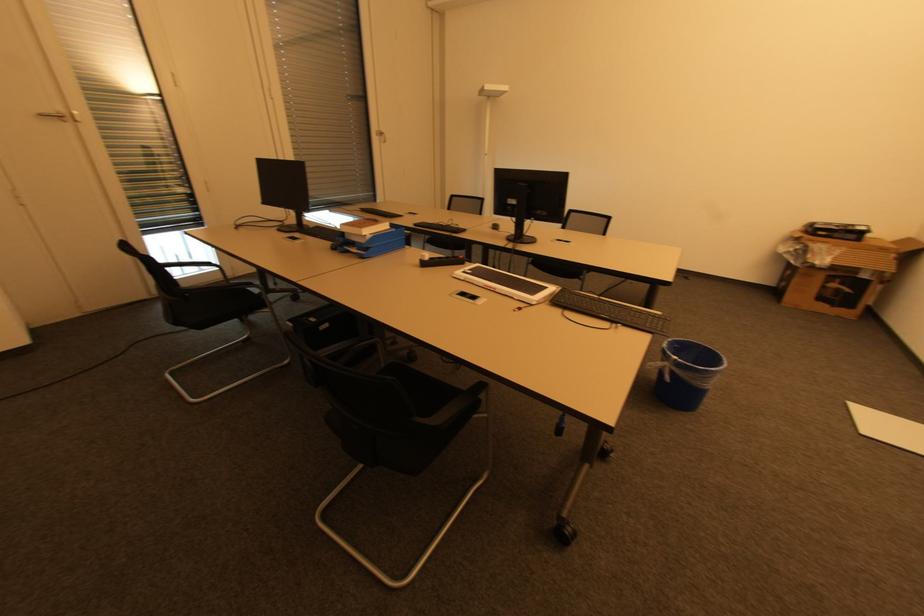
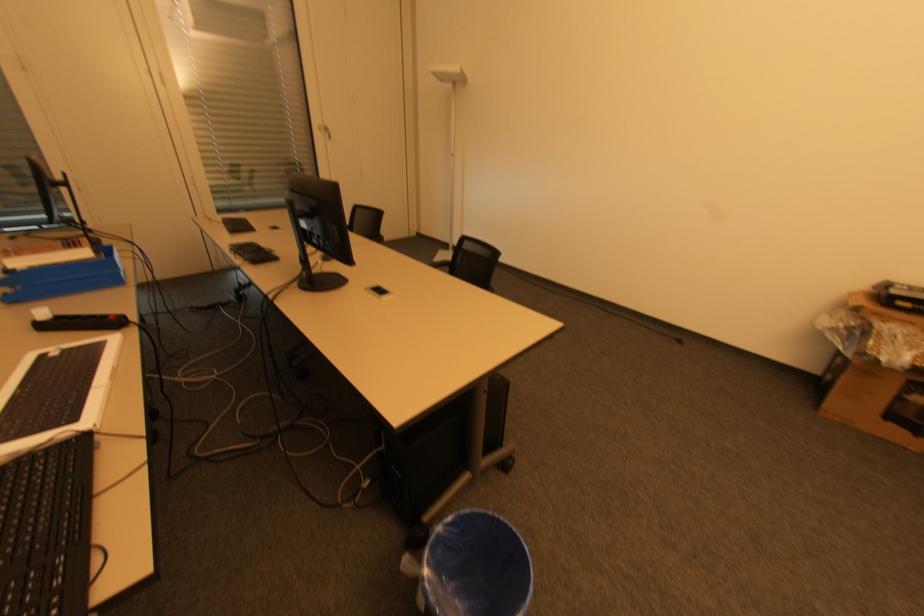
The point at (797,251) is marked in the first image. Where is the corresponding point in the second image?

(850, 328)